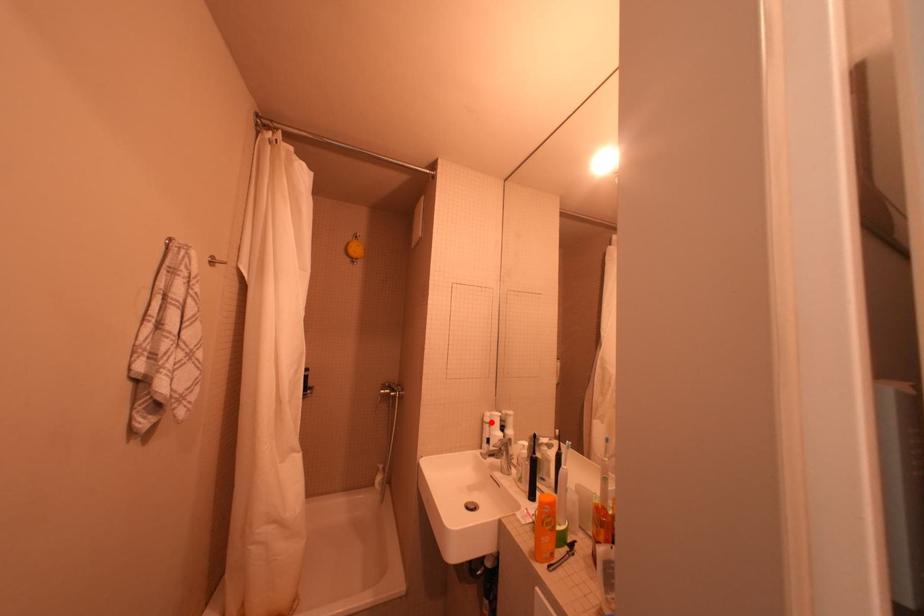
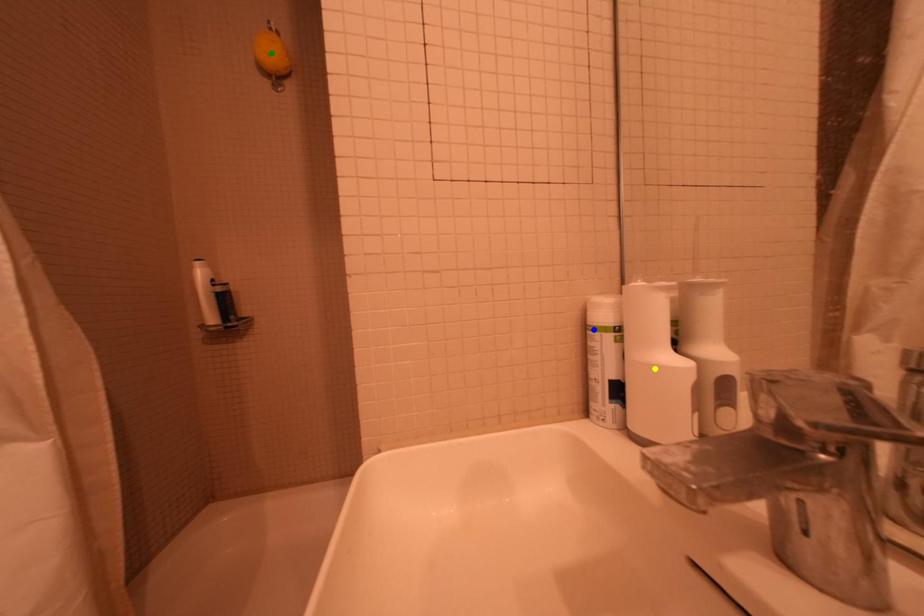
Question: I am providing you with two images of the same scene from different viewpoints. A red point is marked on the first image. You are given multiple points on the second image. In image 2, which mark is for the same physical point as the one in image 1?

Choices:
 (A) yellow point
 (B) green point
 (C) blue point

Answer: (C)